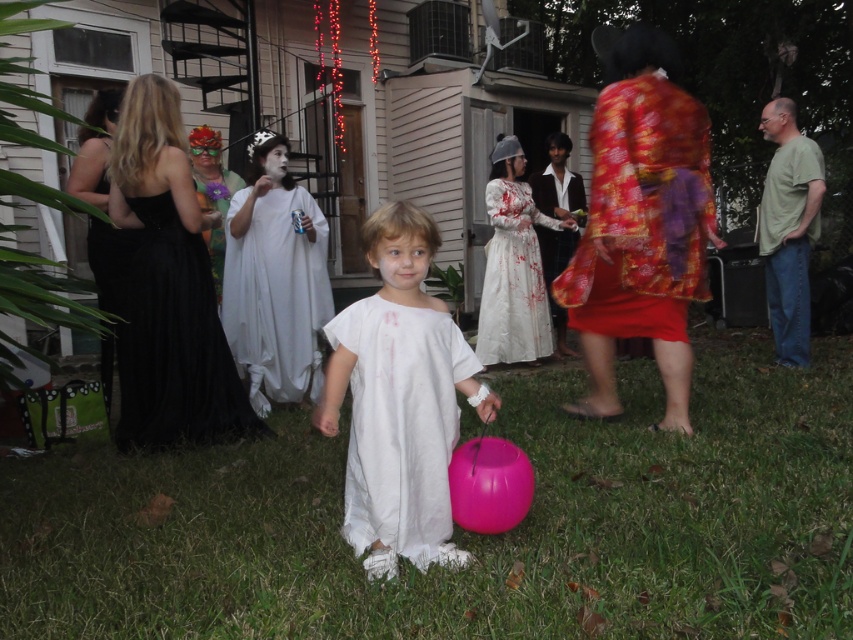
Who is shorter, white matte dress at center or white cotton dress at center?

white matte dress at center is shorter.

Is point (485, 406) positioned before point (480, 340)?

Yes, point (485, 406) is closer to viewer.

Describe the element at coordinates (399, 400) in the screenshot. I see `white matte dress at center` at that location.

Where is `white matte dress at center`? white matte dress at center is located at coordinates (399, 400).

Can you confirm if floral silk robe at right is taller than white cotton dress at center?

No.

Can you confirm if floral silk robe at right is positioned above white cotton dress at center?

Correct, floral silk robe at right is located above white cotton dress at center.

Who is more forward, (624, 289) or (483, 358)?

Point (624, 289) is in front.

The image size is (853, 640). Identify the location of floral silk robe at right. (642, 212).

Which is more to the left, floral silk robe at right or shiny red fabric robe at center?

floral silk robe at right is more to the left.

Between point (627, 326) and point (537, 188), which one is positioned behind?

The point (537, 188) is behind.

Which is behind, point (688, 115) or point (547, 243)?

The point (547, 243) is behind.

This screenshot has height=640, width=853. Identify the location of floral silk robe at right. (642, 212).